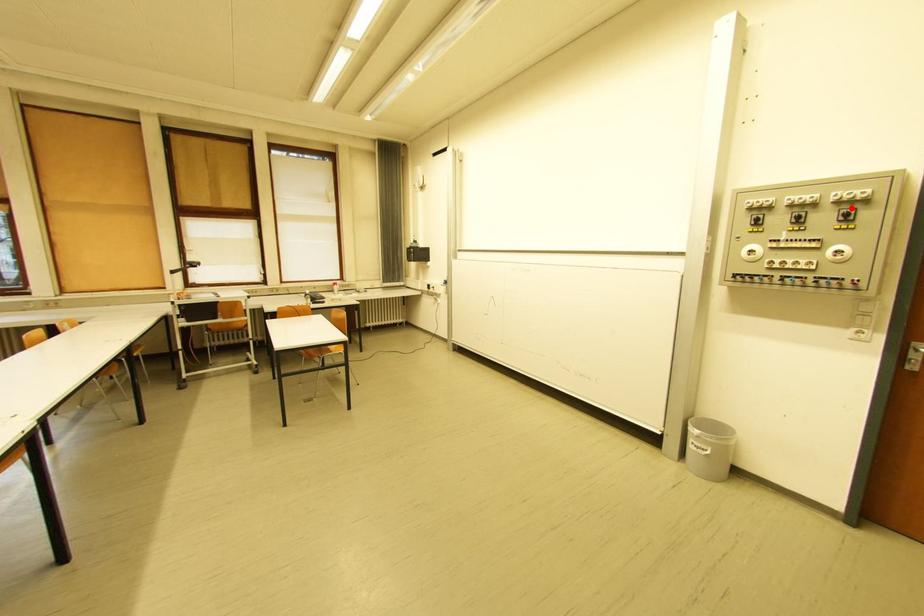
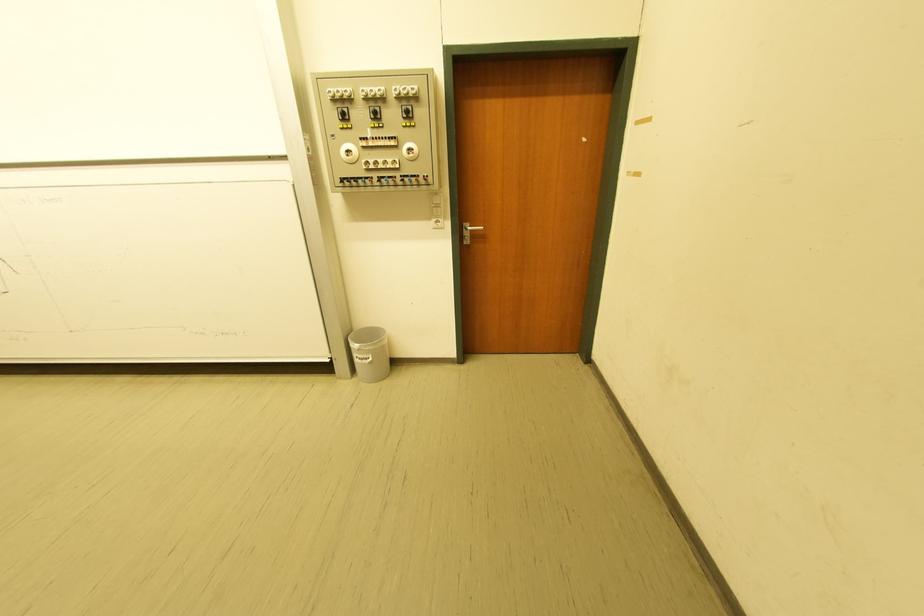
Where in the second image is the point corresponding to the highlighted location from the first image?

(410, 103)